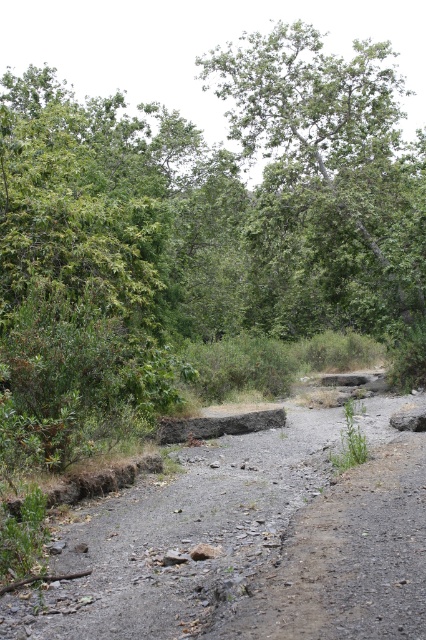
You are a hiker who wants to place a GPS marker exactly at the center of the dull gray gravel at center. What coordinates should you use?

The coordinates for the dull gray gravel at center are at point (250, 541).

You are a hiker trying to navigate the narrow, rocky pathway through the forest. You notice a point marked at coordinates [250,541] on your map. What type of terrain feature is located at this point?

The point at coordinates [250,541] indicates dull gray gravel at center.